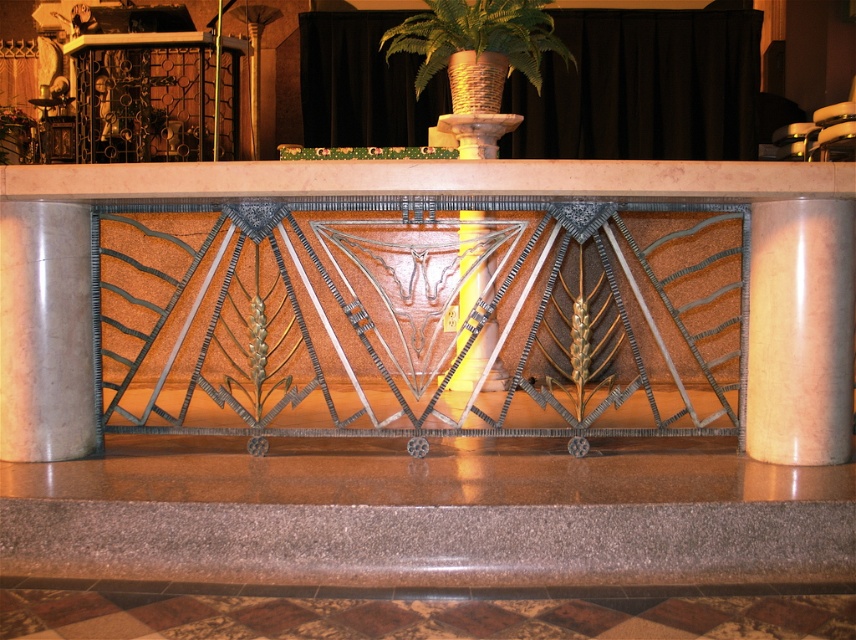
Question: Which object is the closest to the green woven basket at center?

Choices:
 (A) smooth marble pillar at left
 (B) metallic polished pillar at center
 (C) matte pink marble pillar at right

Answer: (B)

Question: Is green woven basket at center below metallic polished pillar at center?

Choices:
 (A) no
 (B) yes

Answer: (A)

Question: Which point is farther to the camera?

Choices:
 (A) metallic polished pillar at center
 (B) smooth marble pillar at left
 (C) green woven basket at center

Answer: (C)

Question: From the image, what is the correct spatial relationship of smooth marble pillar at left in relation to green woven basket at center?

Choices:
 (A) left
 (B) right

Answer: (A)

Question: Among these points, which one is farthest from the camera?

Choices:
 (A) (79, 244)
 (B) (803, 198)

Answer: (A)

Question: Does matte pink marble pillar at right have a lesser width compared to green woven basket at center?

Choices:
 (A) no
 (B) yes

Answer: (B)